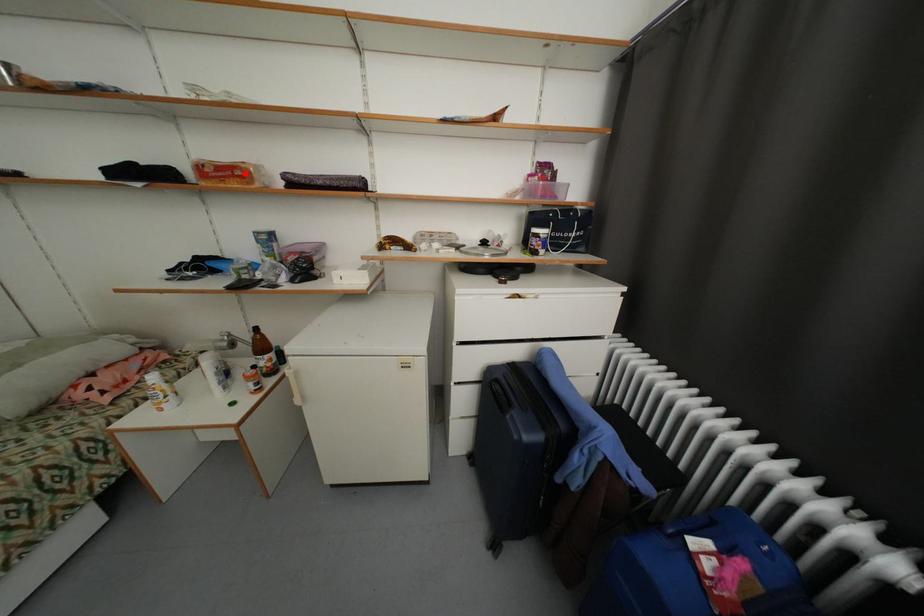
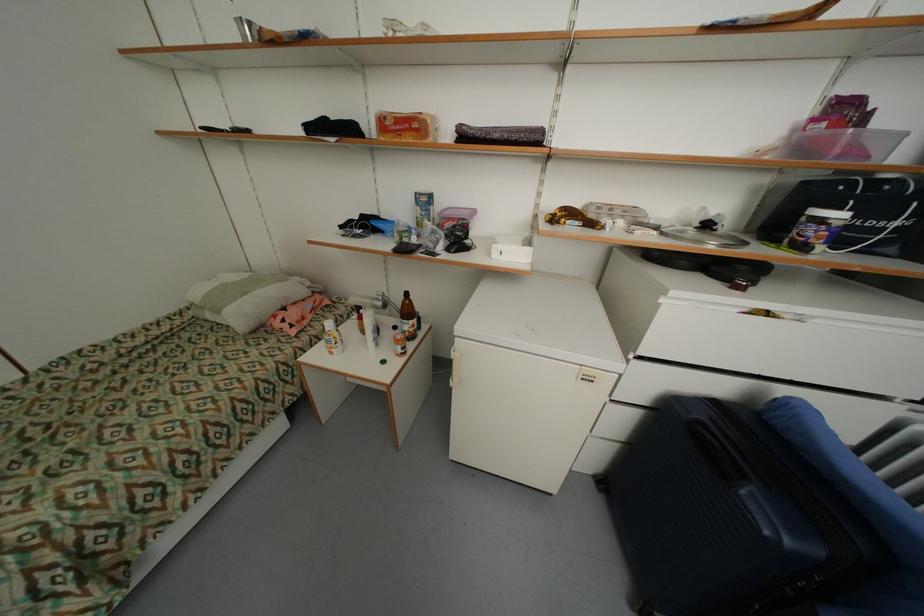
The point at the highlighted location is marked in the first image. Where is the corresponding point in the second image?

(421, 126)